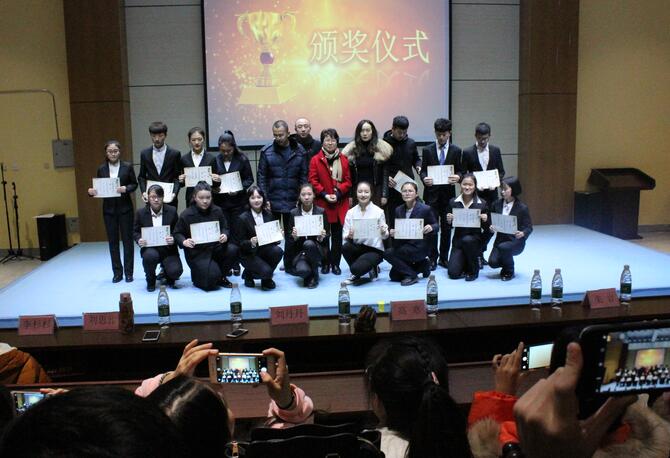
Where is `phone`? The width and height of the screenshot is (670, 458). phone is located at coordinates (240, 366), (536, 362), (639, 360), (23, 397), (153, 334).